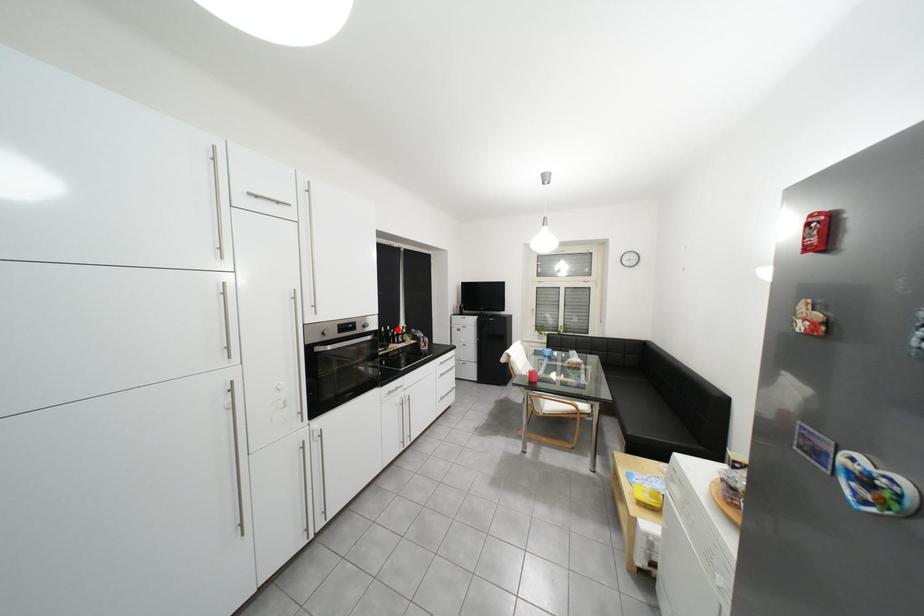
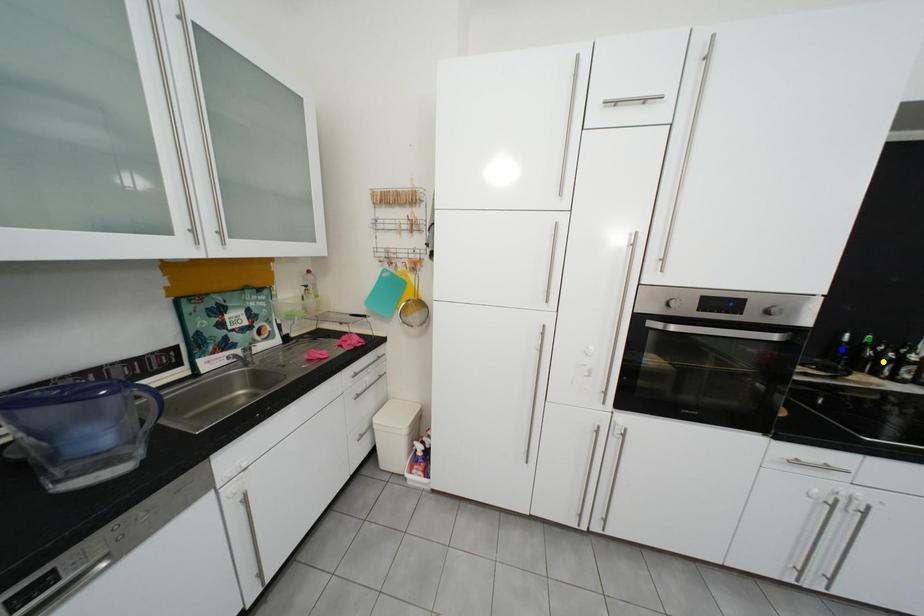
Question: I am providing you with two images of the same scene from different viewpoints. A red point is marked on the first image. You are given multiple points on the second image. Which spot in image 2 lines up with the point in image 1?

Choices:
 (A) blue point
 (B) green point
 (C) yellow point

Answer: (B)